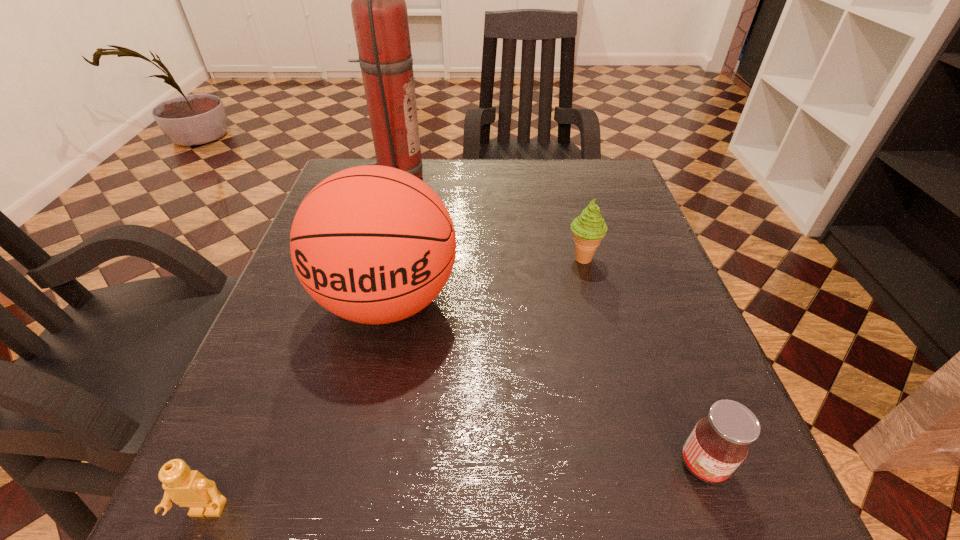
Locate an element on the screen. The width and height of the screenshot is (960, 540). object located in the near left corner section of the desktop is located at coordinates (189, 488).

The height and width of the screenshot is (540, 960). I want to click on object that is at the near right corner, so click(719, 443).

In the image, there is a desktop. Identify the location of vacant space at the far edge. (520, 194).

Identify the location of free space at the left edge. (254, 351).

In the image, there is a desktop. Where is `blank space at the right edge`? The height and width of the screenshot is (540, 960). blank space at the right edge is located at coordinates (692, 383).

Where is `vacant region at the near left corner of the desktop`? Image resolution: width=960 pixels, height=540 pixels. vacant region at the near left corner of the desktop is located at coordinates (310, 521).

Locate an element on the screen. This screenshot has height=540, width=960. free location at the far right corner of the desktop is located at coordinates (625, 193).

In the image, there is a desktop. Identify the location of free space at the near right corner. This screenshot has height=540, width=960. (707, 487).

This screenshot has height=540, width=960. I want to click on vacant space in between the fourth farthest object and the third shortest object, so click(642, 361).

At what (x,y) coordinates should I click in order to perform the action: click on free spot between the nearest object and the second object from right to left. Please return your answer as a coordinate pair (x, y). The width and height of the screenshot is (960, 540). Looking at the image, I should click on (395, 385).